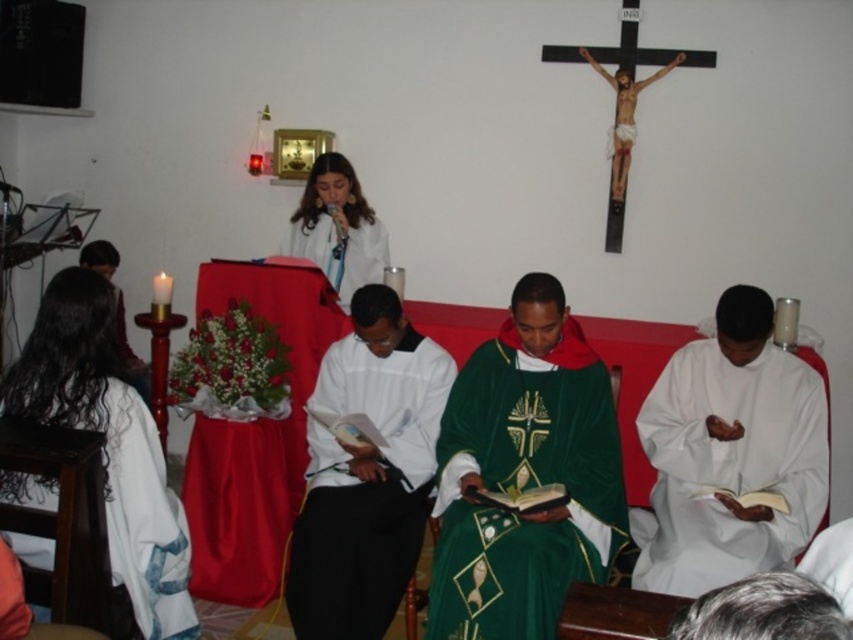
Between green velvet robe at center and white cloth at left, which one has less height?

white cloth at left

Is green velvet robe at center bigger than white cloth at left?

Correct, green velvet robe at center is larger in size than white cloth at left.

Who is more distant from viewer, (517, 349) or (117, 556)?

The point (517, 349) is behind.

Locate an element on the screen. The width and height of the screenshot is (853, 640). green velvet robe at center is located at coordinates (523, 486).

Can you confirm if green velvet robe at center is bigger than white matte robe at lower right?

Incorrect, green velvet robe at center is not larger than white matte robe at lower right.

Is green velvet robe at center closer to camera compared to white matte robe at lower right?

Yes, it is.

Describe the element at coordinates (523, 486) in the screenshot. I see `green velvet robe at center` at that location.

Locate an element on the screen. The height and width of the screenshot is (640, 853). green velvet robe at center is located at coordinates (523, 486).

Does green velvet robe at center appear over white matte robe at upper center?

Actually, green velvet robe at center is below white matte robe at upper center.

Does point (572, 401) lie behind point (376, 259)?

No, (572, 401) is closer to viewer.

In order to click on green velvet robe at center in this screenshot , I will do `click(523, 486)`.